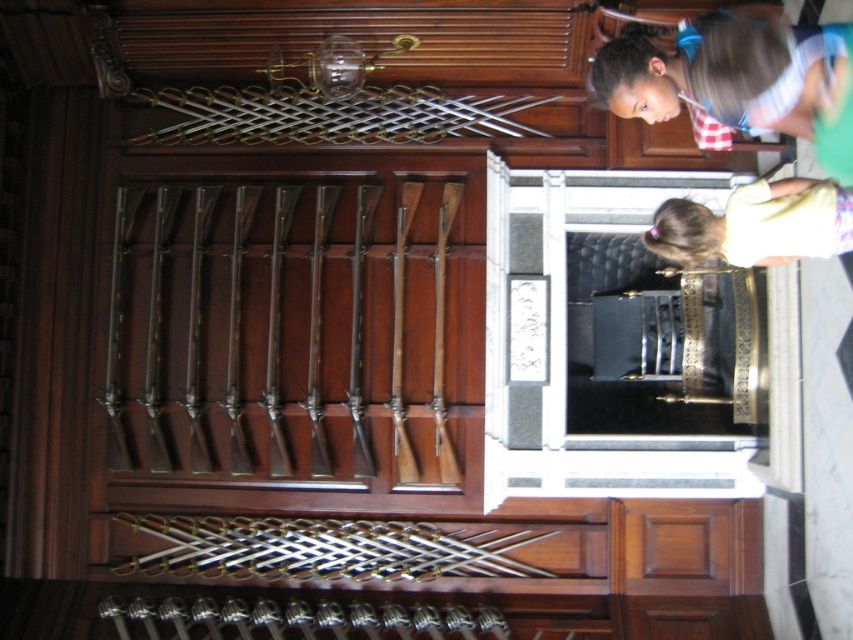
Question: Which point is farther to the camera?

Choices:
 (A) brown wooden rifle at center
 (B) polished brass rifle at center
 (C) polished silver rifle at center

Answer: (C)

Question: In this image, where is light yellow shirt at lower right located relative to wooden rifle at center?

Choices:
 (A) left
 (B) right

Answer: (B)

Question: Which is nearer to the light yellow shirt at lower right?

Choices:
 (A) polished wood rifle at center
 (B) polished brass rifle at center

Answer: (B)

Question: Where is polished brass rifle at center located in relation to polished wood rifle at center in the image?

Choices:
 (A) below
 (B) above

Answer: (A)

Question: Is polished silver rifle at center to the right of brown wooden rifle at center from the viewer's perspective?

Choices:
 (A) no
 (B) yes

Answer: (A)

Question: Among these points, which one is nearest to the camera?

Choices:
 (A) (317, 323)
 (B) (370, 468)
 (C) (276, 452)

Answer: (B)